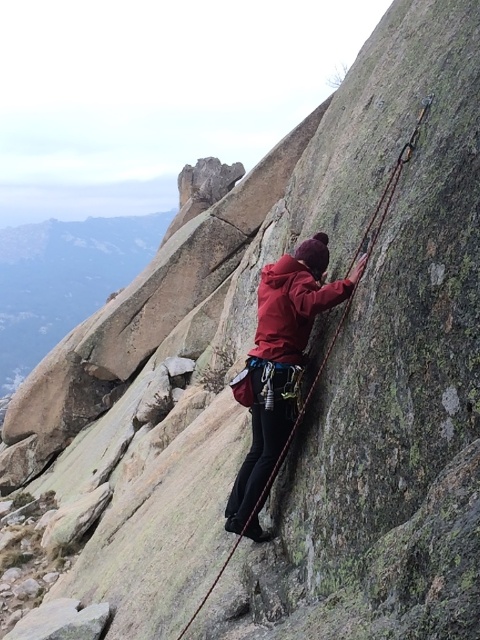
You are a rock climber who needs to check the visibility of your safety rope. Based on the scene, can you see the rope at center clearly while looking at the matte red jacket at center?

The rope at center is behind the matte red jacket at center, so it might be partially obscured and not fully visible.

You are a safety inspector checking the climber. The climber is wearing a matte red jacket at center and has a rope at center. According to safety guidelines, the distance between the climber and the rope should be less than 2 meters to ensure quick adjustments. Is the current distance compliant?

The matte red jacket at center is 2.36 meters from the rope at center. Since 2.36 meters exceeds the 2 meter guideline, the distance is not compliant with safety standards.

You are a climber trying to place an anchor between the two points labeled point [253,497] and point [276,468]. Based on their positions, which point is closer to you as you face the rock face?

Point [276,468] is closer to you because it is in front of point [253,497].